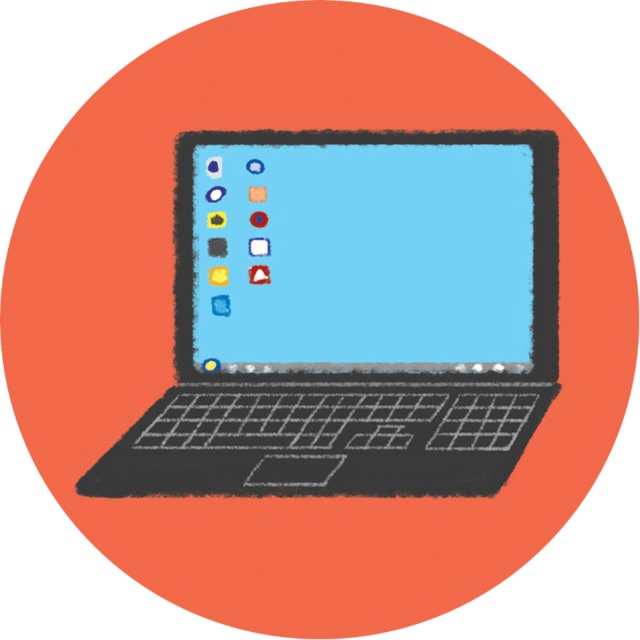
Which is below, matte black laptop at center or matte plastic screen at center?

matte black laptop at center is below.

Does matte black laptop at center have a smaller size compared to matte plastic screen at center?

Actually, matte black laptop at center might be larger than matte plastic screen at center.

Locate an element on the screen. matte black laptop at center is located at coordinates (353, 316).